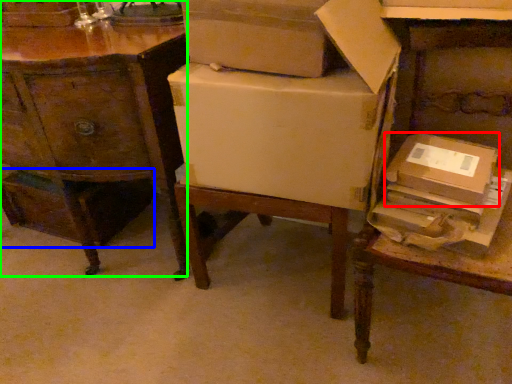
Question: Estimate the real-world distances between objects in this image. Which object is closer to cardboard box (highlighted by a red box), storage box (highlighted by a blue box) or desk (highlighted by a green box)?

Choices:
 (A) storage box
 (B) desk

Answer: (B)